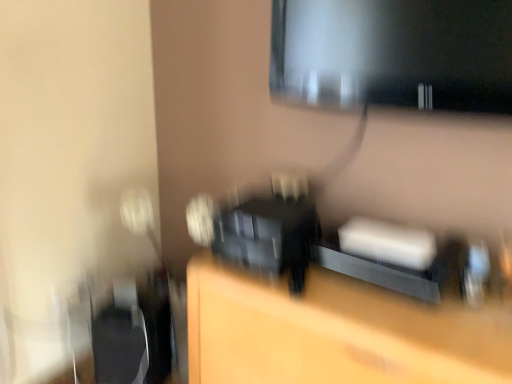
Question: From the image's perspective, is matte black speaker at center above black plastic swivel chair at left?

Choices:
 (A) yes
 (B) no

Answer: (A)

Question: From the image's perspective, is matte black speaker at center beneath black plastic swivel chair at left?

Choices:
 (A) no
 (B) yes

Answer: (A)

Question: Considering the relative positions of matte black speaker at center and black plastic swivel chair at left in the image provided, is matte black speaker at center to the right of black plastic swivel chair at left from the viewer's perspective?

Choices:
 (A) no
 (B) yes

Answer: (B)

Question: Is black plastic swivel chair at left located within matte black speaker at center?

Choices:
 (A) no
 (B) yes

Answer: (A)

Question: Is matte black speaker at center turned away from black plastic swivel chair at left?

Choices:
 (A) no
 (B) yes

Answer: (A)

Question: Is matte black speaker at center in contact with black plastic swivel chair at left?

Choices:
 (A) yes
 (B) no

Answer: (B)

Question: Is matte black speaker at center to the right of matte black monitor at upper right from the viewer's perspective?

Choices:
 (A) yes
 (B) no

Answer: (B)

Question: From a real-world perspective, does matte black speaker at center sit lower than matte black monitor at upper right?

Choices:
 (A) no
 (B) yes

Answer: (B)

Question: Considering the relative sizes of matte black speaker at center and matte black monitor at upper right in the image provided, is matte black speaker at center smaller than matte black monitor at upper right?

Choices:
 (A) yes
 (B) no

Answer: (B)

Question: Considering the relative positions of matte black speaker at center and matte black monitor at upper right in the image provided, is matte black speaker at center to the left of matte black monitor at upper right from the viewer's perspective?

Choices:
 (A) yes
 (B) no

Answer: (A)

Question: Is matte black speaker at center next to matte black monitor at upper right?

Choices:
 (A) yes
 (B) no

Answer: (B)

Question: Is matte black speaker at center taller than matte black monitor at upper right?

Choices:
 (A) no
 (B) yes

Answer: (B)

Question: Does matte black monitor at upper right appear on the left side of matte black speaker at center?

Choices:
 (A) no
 (B) yes

Answer: (A)